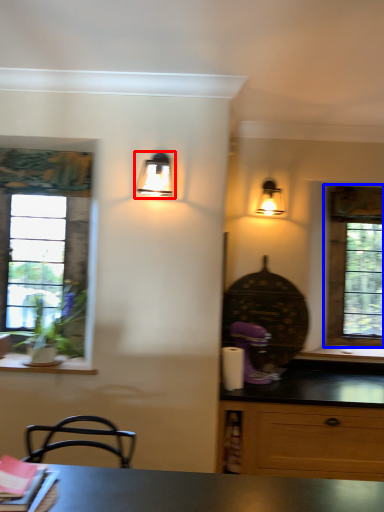
Question: Which point is closer to the camera, lamp (highlighted by a red box) or window (highlighted by a blue box)?

Choices:
 (A) lamp
 (B) window

Answer: (A)